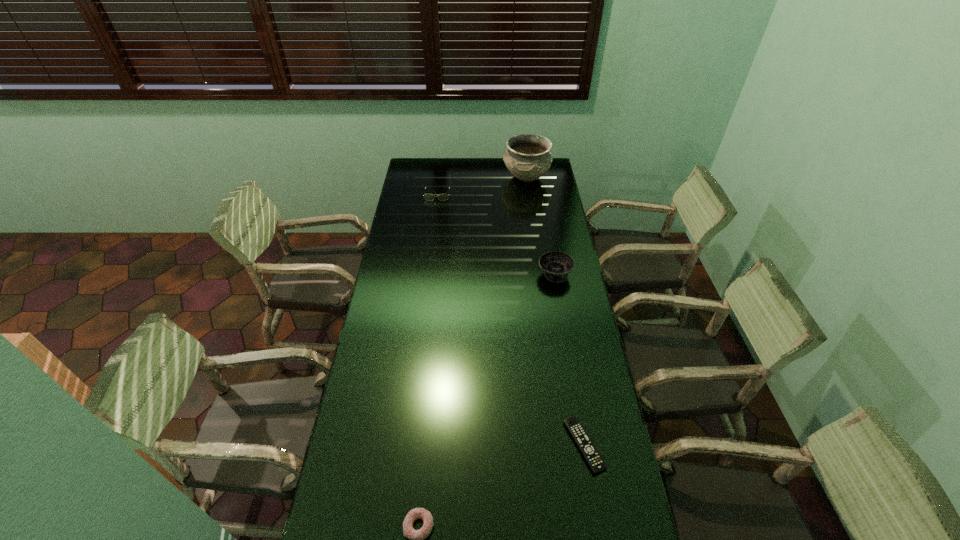
What are the coordinates of `object that is at the far edge` in the screenshot? It's located at (528, 157).

Where is `object that is at the left edge`? object that is at the left edge is located at coordinates (429, 197).

Locate an element on the screen. Image resolution: width=960 pixels, height=540 pixels. pottery at the right edge is located at coordinates (528, 157).

Locate an element on the screen. This screenshot has height=540, width=960. bowl situated at the right edge is located at coordinates 557,265.

Locate an element on the screen. remote control situated at the right edge is located at coordinates (594, 459).

Locate an element on the screen. This screenshot has height=540, width=960. object present at the far right corner is located at coordinates (528, 157).

Image resolution: width=960 pixels, height=540 pixels. In the image, there is a desktop. In order to click on vacant space at the left edge in this screenshot , I will do `click(402, 241)`.

The width and height of the screenshot is (960, 540). In order to click on vacant space at the right edge in this screenshot , I will do `click(564, 373)`.

Where is `vacant region at the far right corner of the desktop`? The image size is (960, 540). vacant region at the far right corner of the desktop is located at coordinates (551, 173).

This screenshot has height=540, width=960. In order to click on free space between the second nearest object and the pottery in this screenshot , I will do `click(555, 311)`.